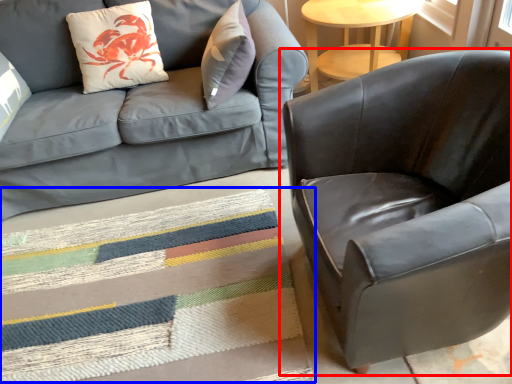
Question: Which object is further to the camera taking this photo, chair (highlighted by a red box) or mat (highlighted by a blue box)?

Choices:
 (A) chair
 (B) mat

Answer: (B)